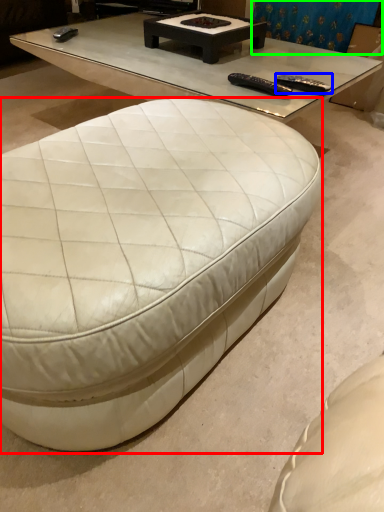
Question: Which object is positioned farthest from coffee table (highlighted by a red box)? Select from remote (highlighted by a blue box) and curtain (highlighted by a green box).

Choices:
 (A) remote
 (B) curtain

Answer: (B)